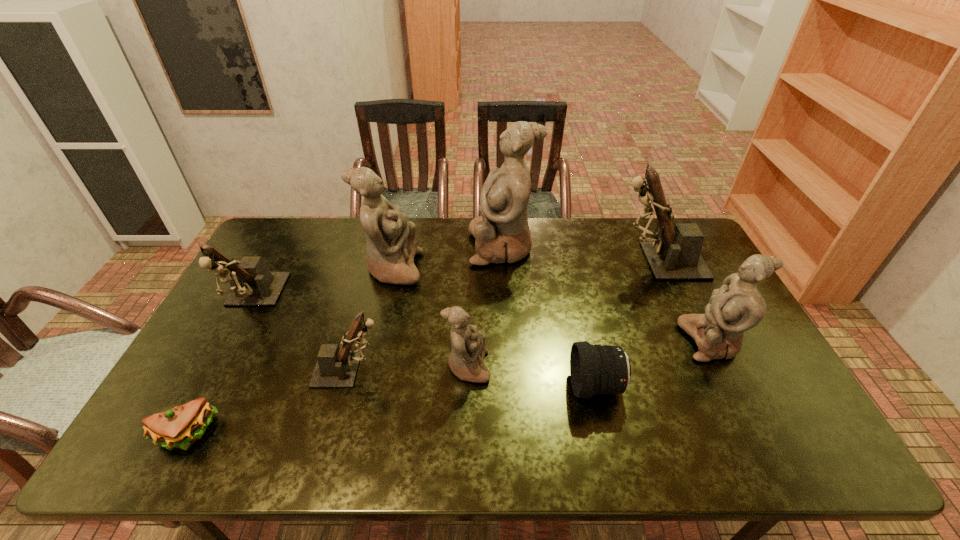
Locate an element on the screen. Image resolution: width=960 pixels, height=540 pixels. blank space located 0.380m on the back of the sandwich is located at coordinates (255, 303).

At what (x,y) coordinates should I click in order to perform the action: click on object that is at the near edge. Please return your answer as a coordinate pair (x, y). Image resolution: width=960 pixels, height=540 pixels. Looking at the image, I should click on (180, 427).

At what (x,y) coordinates should I click in order to perform the action: click on figurine that is at the left edge. Please return your answer as a coordinate pair (x, y). Image resolution: width=960 pixels, height=540 pixels. Looking at the image, I should click on (252, 284).

Identify the location of sandwich present at the left edge. Image resolution: width=960 pixels, height=540 pixels. (180, 427).

Identify the location of object present at the near left corner. The image size is (960, 540). pos(180,427).

Find the location of a particular element. object located in the far right corner section of the desktop is located at coordinates (674, 254).

The width and height of the screenshot is (960, 540). In the image, there is a desktop. Find the location of `free space at the far edge`. free space at the far edge is located at coordinates (554, 235).

Locate an element on the screen. Image resolution: width=960 pixels, height=540 pixels. free space at the near edge is located at coordinates (605, 434).

In the image, there is a desktop. Where is `vacant space at the left edge`? vacant space at the left edge is located at coordinates (196, 359).

I want to click on blank area at the right edge, so click(x=702, y=302).